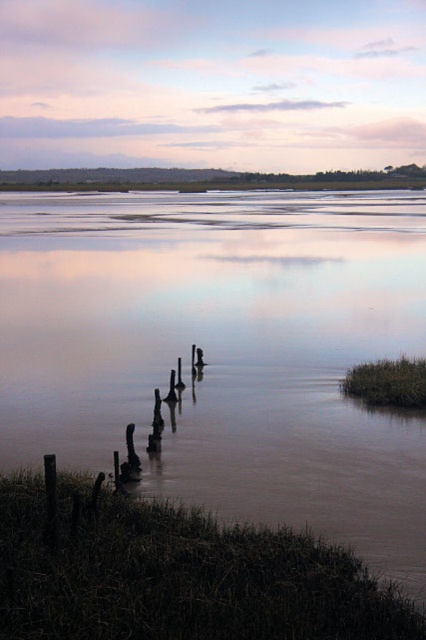
Which of these two, brown muddy water at lower left or dark brown wood posts at lower left, stands taller?

With more height is brown muddy water at lower left.

Who is more forward, (405, 429) or (284, 628)?

Point (284, 628) is more forward.

Is point (167, 493) behind point (111, 522)?

That is True.

Locate an element on the screen. brown muddy water at lower left is located at coordinates (224, 352).